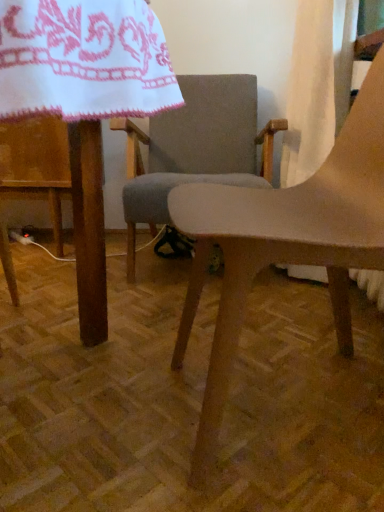
Question: From the image's perspective, does matte wood table at center appear lower than matte wood chair at center, the second chair viewed from the back?

Choices:
 (A) yes
 (B) no

Answer: (A)

Question: Does matte wood table at center touch matte wood chair at center, the second chair viewed from the back?

Choices:
 (A) yes
 (B) no

Answer: (B)

Question: Considering the relative positions of matte wood table at center and matte wood chair at center, the second chair viewed from the back, in the image provided, is matte wood table at center to the right of matte wood chair at center, the second chair viewed from the back, from the viewer's perspective?

Choices:
 (A) yes
 (B) no

Answer: (B)

Question: Is matte wood table at center oriented away from matte wood chair at center, the 1th chair when ordered from front to back?

Choices:
 (A) yes
 (B) no

Answer: (A)

Question: Does matte wood table at center come behind matte wood chair at center, the 1th chair when ordered from front to back?

Choices:
 (A) no
 (B) yes

Answer: (A)

Question: Can you confirm if matte wood table at center is smaller than matte wood chair at center, the second chair viewed from the back?

Choices:
 (A) no
 (B) yes

Answer: (A)

Question: Does white fabric curtain at upper right have a larger size compared to matte wood table at center?

Choices:
 (A) no
 (B) yes

Answer: (A)

Question: Considering the relative sizes of white fabric curtain at upper right and matte wood table at center in the image provided, is white fabric curtain at upper right wider than matte wood table at center?

Choices:
 (A) no
 (B) yes

Answer: (A)

Question: Considering the relative positions of white fabric curtain at upper right and matte wood table at center in the image provided, is white fabric curtain at upper right behind matte wood table at center?

Choices:
 (A) no
 (B) yes

Answer: (B)

Question: Does white fabric curtain at upper right have a smaller size compared to matte wood table at center?

Choices:
 (A) no
 (B) yes

Answer: (B)

Question: Is white fabric curtain at upper right aimed at matte wood table at center?

Choices:
 (A) yes
 (B) no

Answer: (B)

Question: From a real-world perspective, is white fabric curtain at upper right beneath matte wood table at center?

Choices:
 (A) no
 (B) yes

Answer: (A)

Question: Is matte wood chair at center, the second chair viewed from the back, shorter than gray fabric chair at center, which is the 1th chair in back-to-front order?

Choices:
 (A) yes
 (B) no

Answer: (A)